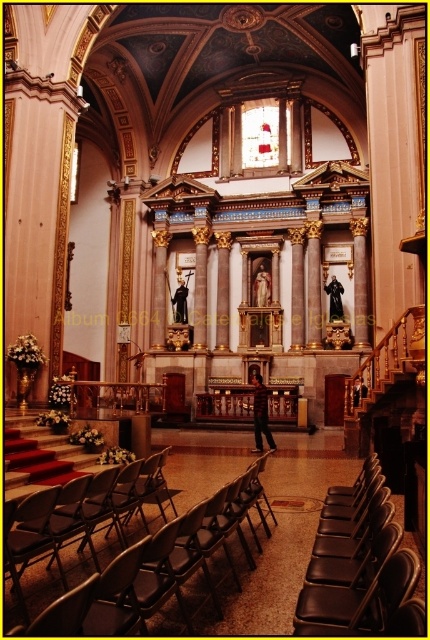
Who is taller, black leather chair at lower center or dark brown leather jacket at center?

Standing taller between the two is dark brown leather jacket at center.

Who is positioned more to the right, black leather chair at lower center or dark brown leather jacket at center?

black leather chair at lower center is more to the right.

Is point (362, 614) in front of point (264, 429)?

Yes.

The image size is (430, 640). Find the location of `black leather chair at lower center`. black leather chair at lower center is located at coordinates [359, 600].

Between point (27, 576) and point (266, 401), which one is positioned in front?

Point (27, 576)

Locate an element on the screen. metallic silver chair at center is located at coordinates (202, 474).

This screenshot has height=640, width=430. Find the location of `metallic silver chair at center`. metallic silver chair at center is located at coordinates point(202,474).

Is point (321, 584) positioned after point (355, 620)?

Yes, it is.

Identify the location of black leather chairs at lower right. This screenshot has height=640, width=430. (362, 592).